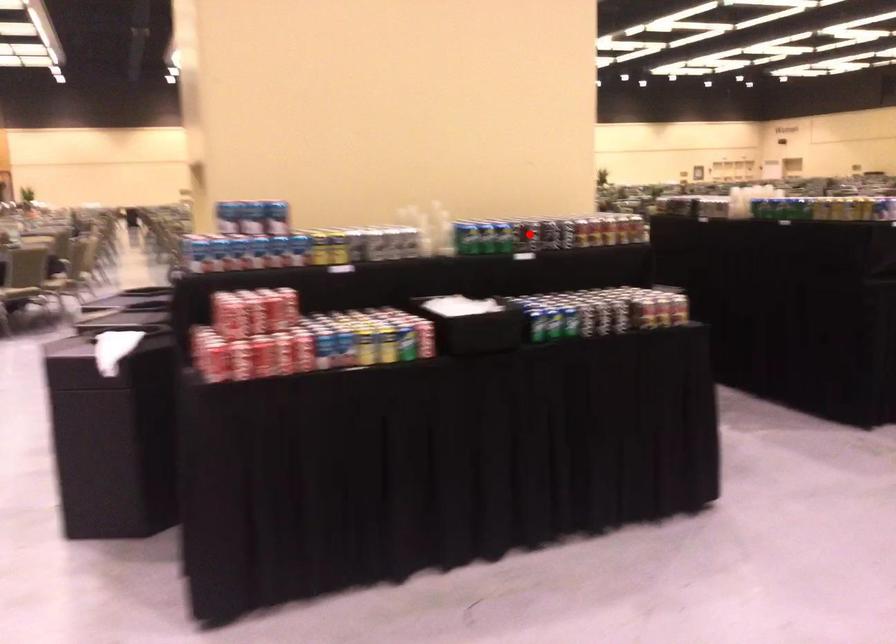
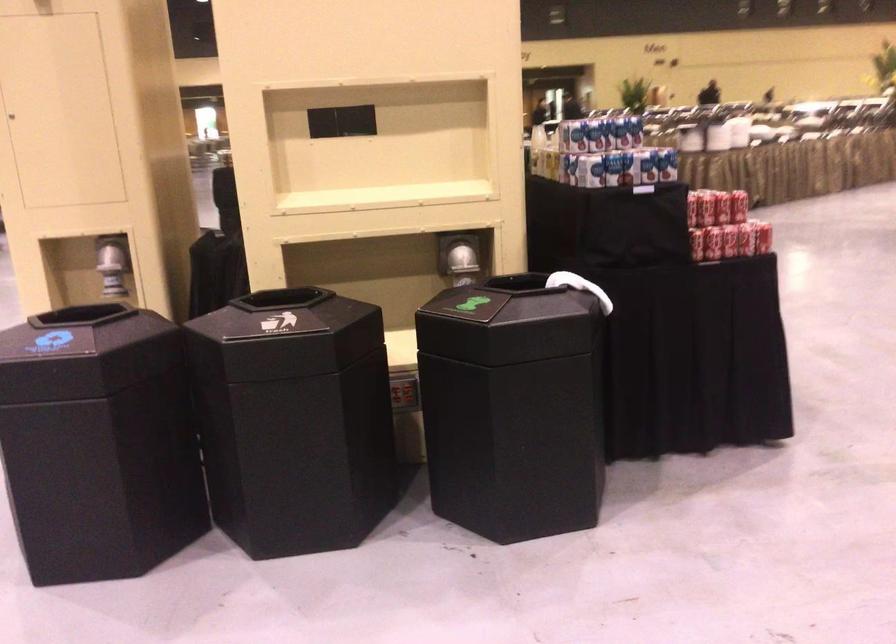
Question: I am providing you with two images of the same scene from different viewpoints. A red point is marked on the first image. Is the red point's position out of view in image 2?

Choices:
 (A) Yes
 (B) No

Answer: (A)